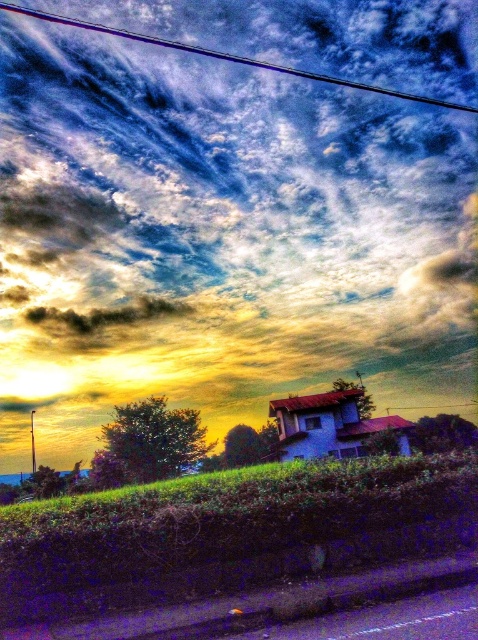
You are standing in front of the house with a red roof and light colored walls. You want to take a photo of the cloudy sky at upper center. Where should you look to capture it in your camera viewfinder?

You should look at point (223, 186) to capture the cloudy sky at upper center in your camera viewfinder.

Consider the image. You are an astronomer observing the sky from the balcony of the house. You notice two objects in the upper center of your view. Which one is higher in the sky between the cloudy sky at upper center and the metallic wire at upper center?

The cloudy sky at upper center is taller than the metallic wire at upper center, so the cloudy sky at upper center is higher in the sky.

You are an astronomer observing the sky and notice the cloudy sky at upper center and metallic wire at upper center. From your viewpoint, which object is positioned to the right?

The cloudy sky at upper center is positioned to the right of the metallic wire at upper center.